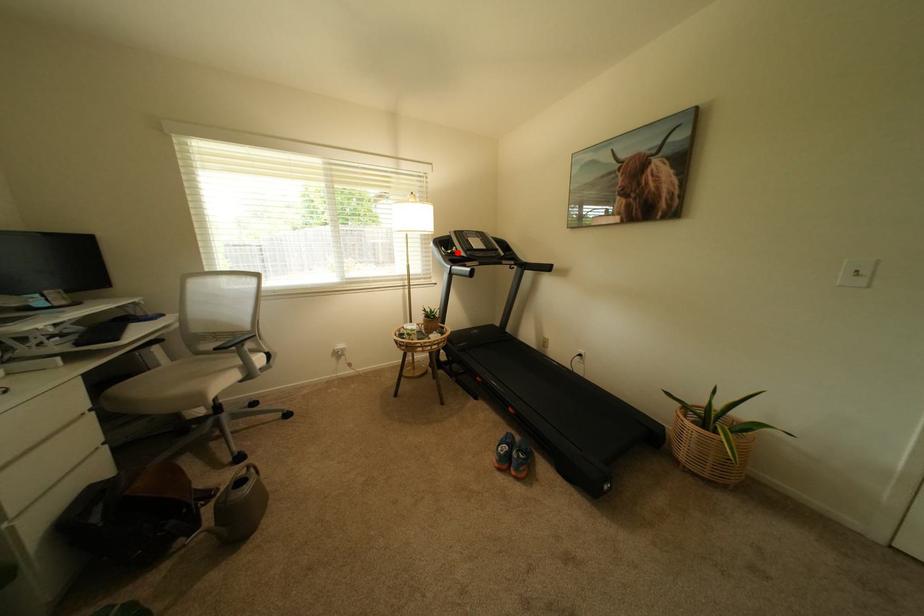
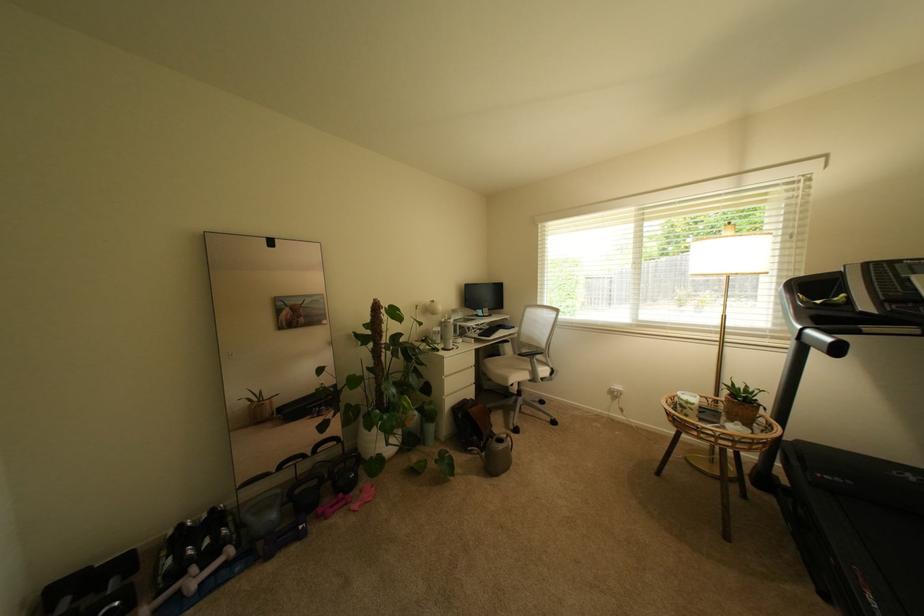
Question: I am providing you with two images of the same scene from different viewpoints. Given a red point in image1, look at the same physical point in image2. Is it:

Choices:
 (A) Closer to the viewpoint
 (B) Farther from the viewpoint

Answer: (B)